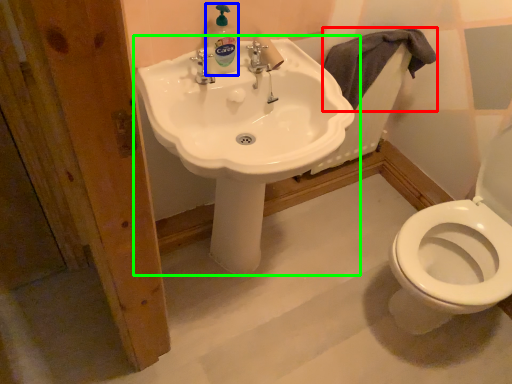
Question: Which object is the farthest from bath towel (highlighted by a red box)? Choose among these: cleaning product (highlighted by a blue box) or sink (highlighted by a green box).

Choices:
 (A) cleaning product
 (B) sink

Answer: (A)